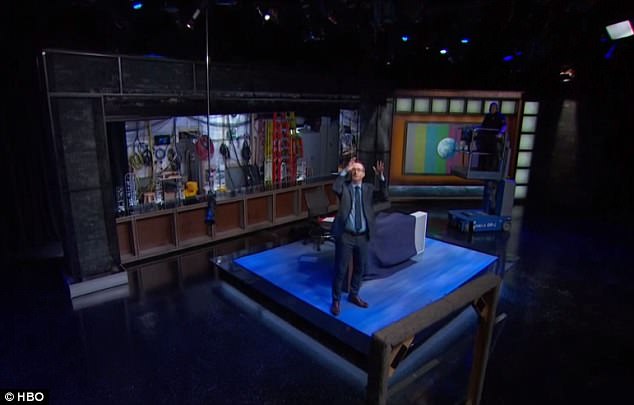
The width and height of the screenshot is (634, 405). Identify the location of blue floor. (404, 294), (264, 255).